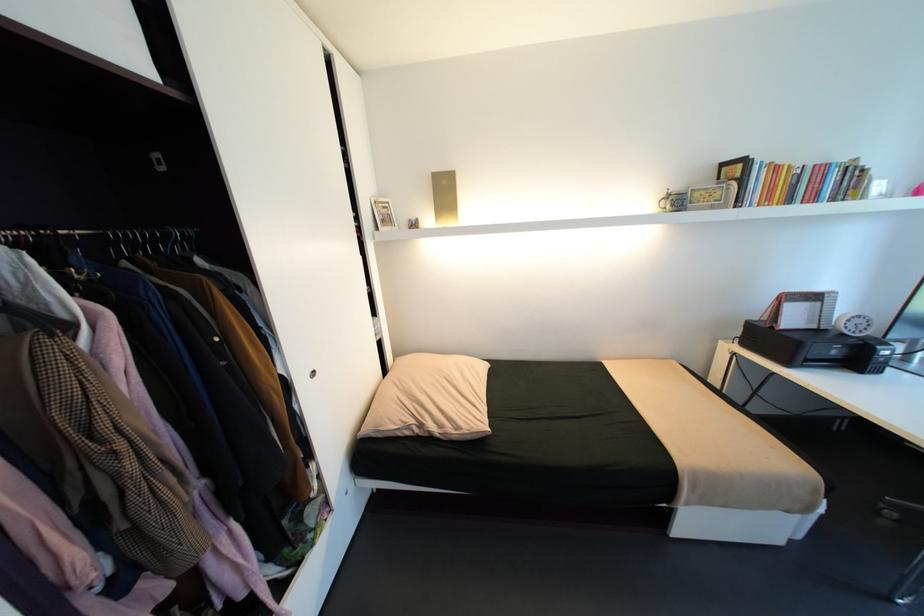
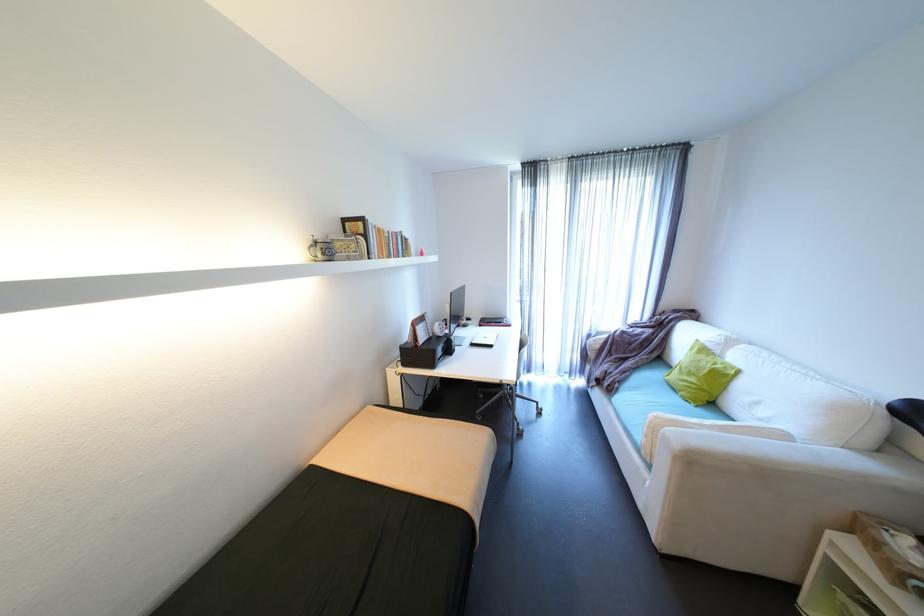
Where in the second image is the point corresponding to point (799, 301) from the first image?

(426, 323)